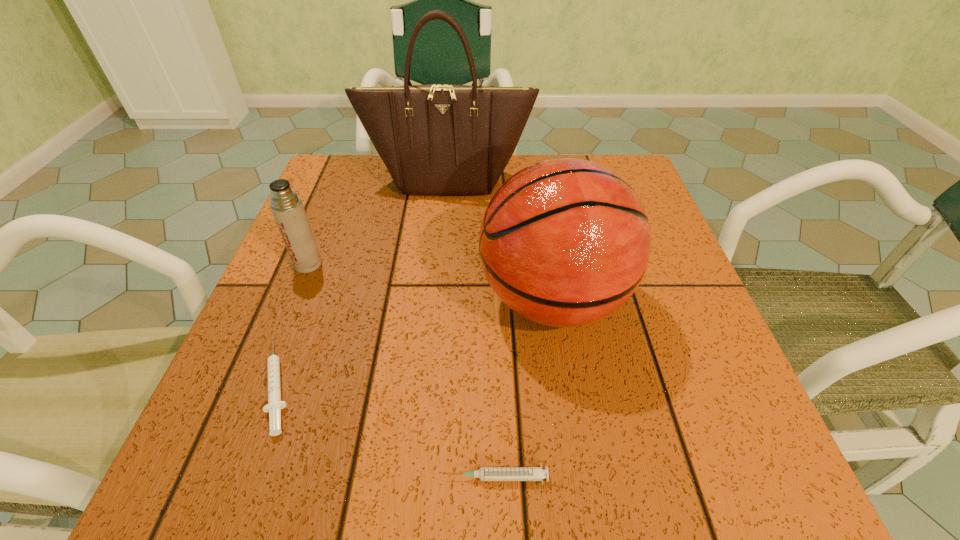
Locate an element on the screen. The width and height of the screenshot is (960, 540). vacant space that's between the tallest object and the third shortest object is located at coordinates (378, 222).

At what (x,y) coordinates should I click in order to perform the action: click on free space between the farther syringe and the right syringe. Please return your answer as a coordinate pair (x, y). Looking at the image, I should click on tap(388, 430).

This screenshot has width=960, height=540. I want to click on vacant area between the farther syringe and the third shortest object, so click(x=293, y=324).

Identify the location of free space between the farther syringe and the fourth shortest object. (416, 342).

You are a GUI agent. You are given a task and a screenshot of the screen. Output one action in this format:
    pyautogui.click(x=<x>, y=<y>)
    Task: Click on the empty space that is in between the fourth shortest object and the thermos bottle
    The width and height of the screenshot is (960, 540).
    Given the screenshot: What is the action you would take?
    pyautogui.click(x=430, y=282)

The image size is (960, 540). Find the location of `blank region between the farther syringe and the nearer syringe`. blank region between the farther syringe and the nearer syringe is located at coordinates (388, 430).

At what (x,y) coordinates should I click in order to perform the action: click on vacant area that lies between the farthest object and the farther syringe. Please return your answer as a coordinate pair (x, y). This screenshot has height=540, width=960. Looking at the image, I should click on (363, 282).

Where is `the second closest object to the second tallest object`? the second closest object to the second tallest object is located at coordinates (436, 139).

Where is `object identified as the fourth closest to the fourth shortest object`? The image size is (960, 540). object identified as the fourth closest to the fourth shortest object is located at coordinates (287, 207).